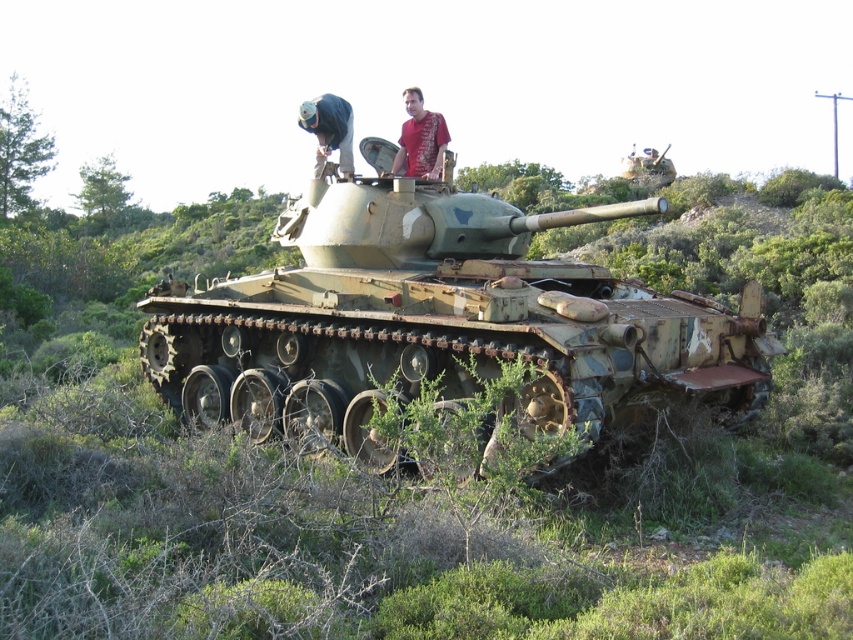
Does rusty metal tank at center have a smaller size compared to blue fabric hat at upper center?

No, rusty metal tank at center is not smaller than blue fabric hat at upper center.

Does point (447, 298) come farther from viewer compared to point (317, 157)?

No.

Who is more forward, [448,225] or [309,108]?

Point [448,225]

Locate an element on the screen. This screenshot has height=640, width=853. rusty metal tank at center is located at coordinates (434, 323).

Can you confirm if red fabric shirt at upper center is bigger than blue fabric hat at upper center?

Actually, red fabric shirt at upper center might be smaller than blue fabric hat at upper center.

Looking at this image, can you confirm if red fabric shirt at upper center is taller than blue fabric hat at upper center?

Yes, red fabric shirt at upper center is taller than blue fabric hat at upper center.

Is point (436, 163) closer to camera compared to point (341, 108)?

That is True.

Where is `red fabric shirt at upper center`? The width and height of the screenshot is (853, 640). red fabric shirt at upper center is located at coordinates (419, 140).

Does rusty metal tank at center have a larger size compared to red fabric shirt at upper center?

Indeed, rusty metal tank at center has a larger size compared to red fabric shirt at upper center.

Between point (424, 285) and point (407, 138), which one is positioned in front?

Point (424, 285) is in front.

Measure the distance between rusty metal tank at center and camera.

rusty metal tank at center and camera are 7.85 meters apart.

Where is `rusty metal tank at center`? The image size is (853, 640). rusty metal tank at center is located at coordinates (434, 323).